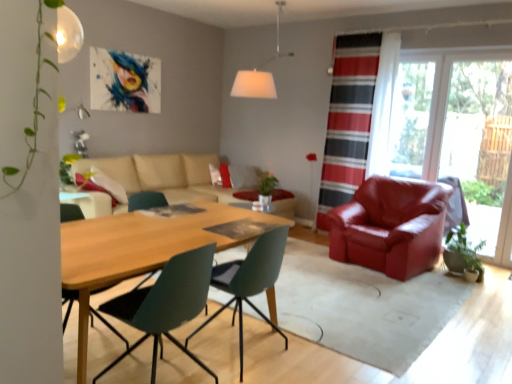
What are the coordinates of `vacant area that is in front of satin red armchair at right, which is the 1th chair from back to front` in the screenshot? It's located at (403, 294).